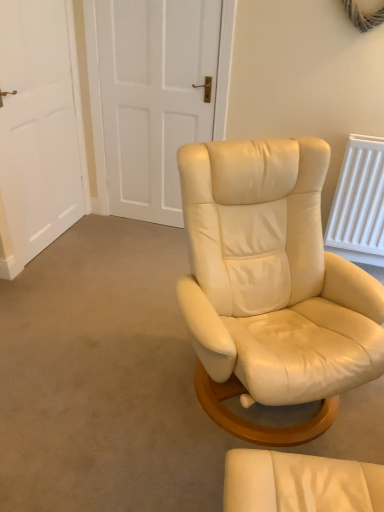
Image resolution: width=384 pixels, height=512 pixels. In order to click on free space in front of white matte door at upper center, the first door positioned from the right in this screenshot , I will do `click(140, 251)`.